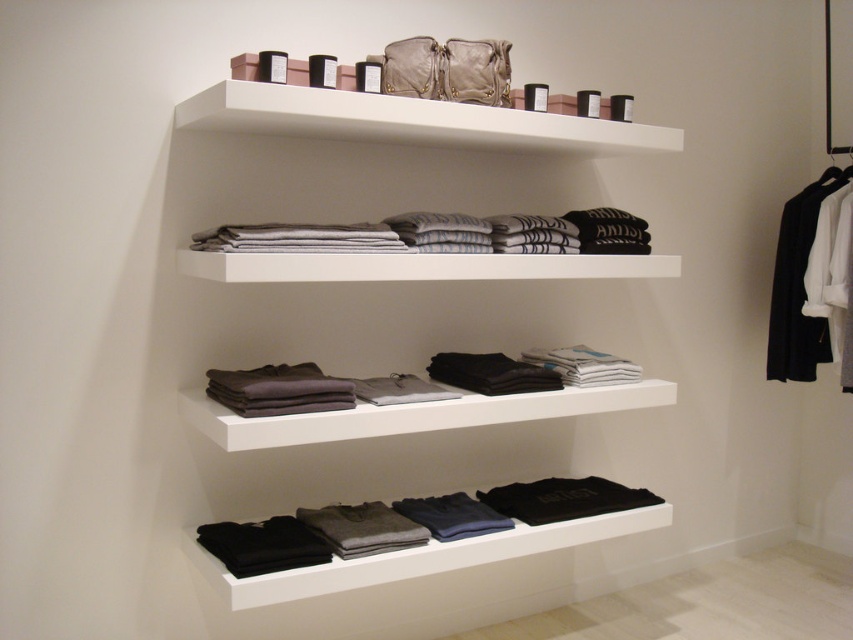
Question: From the image, what is the correct spatial relationship of black matte t-shirt at lower center in relation to dark gray fleece gloves at lower center?

Choices:
 (A) above
 (B) below

Answer: (A)

Question: Which object appears closest to the camera in this image?

Choices:
 (A) white matte shelf at upper center
 (B) dark gray fabric shirts at center
 (C) dark gray fleece gloves at lower center

Answer: (A)

Question: Is black fabric coat at right further to the viewer compared to dark gray cotton t-shirt at lower center?

Choices:
 (A) yes
 (B) no

Answer: (A)

Question: Which object is positioned farthest from the dark gray cotton t-shirt at lower center?

Choices:
 (A) dark matte fabric at center
 (B) gray cotton t-shirts at center
 (C) white matte shelf at upper center
 (D) dark gray fleece gloves at lower center

Answer: (C)

Question: Among these points, which one is farthest from the camera?

Choices:
 (A) (427, 236)
 (B) (250, 113)
 (C) (498, 520)
 (D) (590, 508)

Answer: (D)

Question: Where is black fabric coat at right located in relation to dark gray fleece gloves at lower center in the image?

Choices:
 (A) left
 (B) right

Answer: (B)